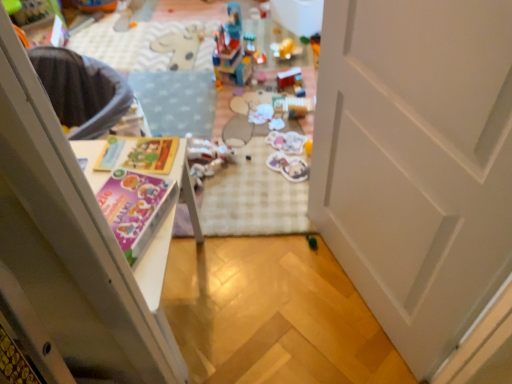
Locate an element on the screen. This screenshot has height=384, width=512. vacant area that lies between matte plastic stickers at center, which ranks as the fifth toy in top-to-bottom order, and translucent plastic toy at center, placed as the 4th toy when sorted from top to bottom is located at coordinates (254, 164).